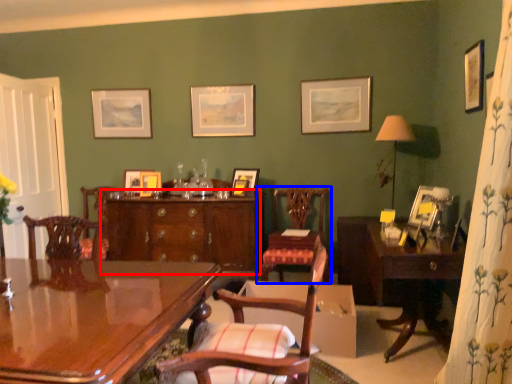
Question: Which point is closer to the camera, cabinetry (highlighted by a red box) or chair (highlighted by a blue box)?

Choices:
 (A) cabinetry
 (B) chair

Answer: (B)